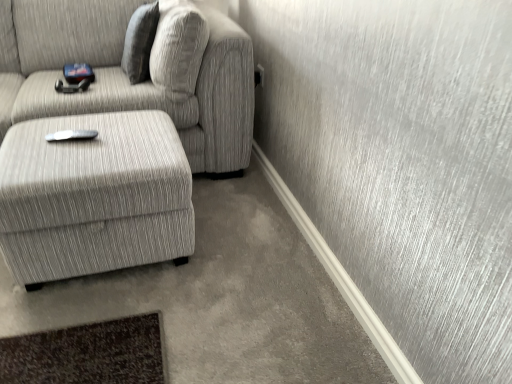
This screenshot has height=384, width=512. I want to click on textured gray pillow at upper center, so click(140, 42).

Locate an element on the screen. textured gray pillow at upper center is located at coordinates (140, 42).

Is point (55, 71) closer or farther from the camera than point (134, 26)?

Point (55, 71) is farther from the camera than point (134, 26).

From their relative heights in the image, would you say textured gray fabric couch at left is taller or shorter than textured gray pillow at upper center?

Clearly, textured gray fabric couch at left is taller compared to textured gray pillow at upper center.

Does textured gray fabric couch at left have a larger size compared to textured gray pillow at upper center?

Indeed, textured gray fabric couch at left has a larger size compared to textured gray pillow at upper center.

Can you confirm if textured gray pillow at upper center is bigger than textured gray fabric couch at left?

No, textured gray pillow at upper center is not bigger than textured gray fabric couch at left.

Can you confirm if textured gray pillow at upper center is wider than textured gray fabric couch at left?

No, textured gray pillow at upper center is not wider than textured gray fabric couch at left.

Choose the correct answer: Is textured gray fabric couch at left inside textured gray ottoman at lower left or outside it?

textured gray fabric couch at left is not enclosed by textured gray ottoman at lower left.

Can you tell me how much textured gray fabric couch at left and textured gray ottoman at lower left differ in facing direction?

There is a 0.947-degree angle between the facing directions of textured gray fabric couch at left and textured gray ottoman at lower left.

Considering the sizes of textured gray fabric couch at left and textured gray ottoman at lower left in the image, is textured gray fabric couch at left taller or shorter than textured gray ottoman at lower left?

textured gray fabric couch at left is taller than textured gray ottoman at lower left.

Between point (146, 20) and point (17, 221), which one is positioned in front?

Positioned in front is point (17, 221).

How many degrees apart are the facing directions of textured gray pillow at upper center and textured gray ottoman at lower left?

The angle between the facing direction of textured gray pillow at upper center and the facing direction of textured gray ottoman at lower left is 88 degrees.

Are textured gray pillow at upper center and textured gray ottoman at lower left making contact?

No, textured gray pillow at upper center is not touching textured gray ottoman at lower left.

Is point (21, 139) closer to viewer compared to point (127, 73)?

Yes, point (21, 139) is in front of point (127, 73).

Consider the image. In the image, is textured gray ottoman at lower left on the left side or the right side of textured gray pillow at upper center?

textured gray ottoman at lower left is to the left of textured gray pillow at upper center.

From the picture: From the image's perspective, is textured gray ottoman at lower left above or below textured gray pillow at upper center?

Clearly, from the image's perspective, textured gray ottoman at lower left is below textured gray pillow at upper center.

Is the depth of textured gray ottoman at lower left less than that of textured gray pillow at upper center?

Yes, textured gray ottoman at lower left is closer to the viewer.

Could you tell me if textured gray ottoman at lower left is turned towards textured gray fabric couch at left?

No, textured gray ottoman at lower left is not facing towards textured gray fabric couch at left.

Can you see textured gray ottoman at lower left touching textured gray fabric couch at left?

textured gray ottoman at lower left and textured gray fabric couch at left are not in contact.

From a real-world perspective, which is physically below, textured gray ottoman at lower left or textured gray fabric couch at left?

textured gray ottoman at lower left.

Is textured gray ottoman at lower left located outside textured gray fabric couch at left?

Yes, textured gray ottoman at lower left is outside of textured gray fabric couch at left.

What are the coordinates of `studio couch lying on the left of textured gray pillow at upper center` in the screenshot? It's located at (134, 69).

This screenshot has width=512, height=384. I want to click on pillow that appears on the right of textured gray fabric couch at left, so click(140, 42).

Considering their positions, is textured gray ottoman at lower left positioned closer to textured gray pillow at upper center than textured gray fabric couch at left?

Among the two, textured gray fabric couch at left is located nearer to textured gray pillow at upper center.

Looking at the image, which one is located further to textured gray fabric couch at left, textured gray pillow at upper center or textured gray ottoman at lower left?

Among the two, textured gray ottoman at lower left is located further to textured gray fabric couch at left.

Which object lies further to the anchor point textured gray ottoman at lower left, textured gray fabric couch at left or textured gray pillow at upper center?

textured gray pillow at upper center.

Based on their spatial positions, is textured gray ottoman at lower left or textured gray pillow at upper center closer to textured gray fabric couch at left?

The object closer to textured gray fabric couch at left is textured gray pillow at upper center.

From the image, which object appears to be nearer to textured gray ottoman at lower left, textured gray pillow at upper center or textured gray fabric couch at left?

textured gray fabric couch at left lies closer to textured gray ottoman at lower left than the other object.

Looking at the image, which one is located further to textured gray pillow at upper center, textured gray fabric couch at left or textured gray ottoman at lower left?

The object further to textured gray pillow at upper center is textured gray ottoman at lower left.

The height and width of the screenshot is (384, 512). I want to click on studio couch between textured gray pillow at upper center and textured gray ottoman at lower left in the up-down direction, so click(134, 69).